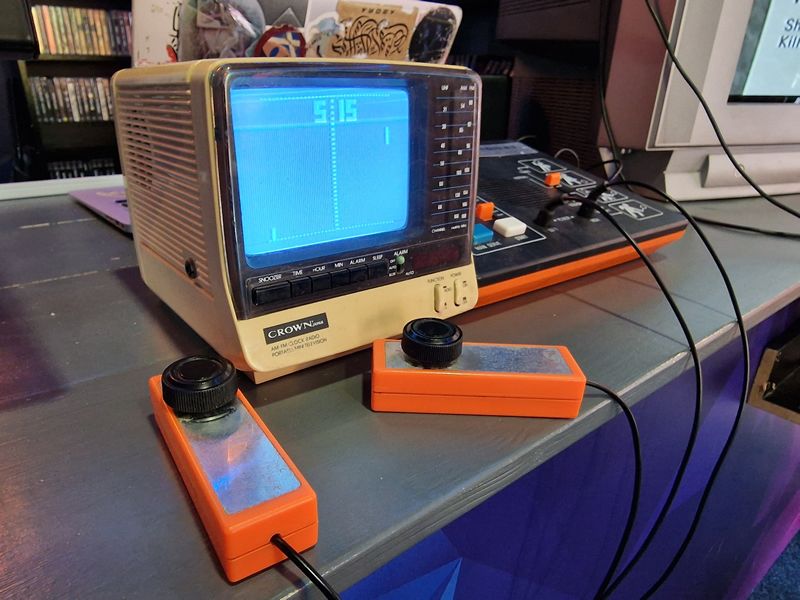
I want to click on console, so click(562, 254).